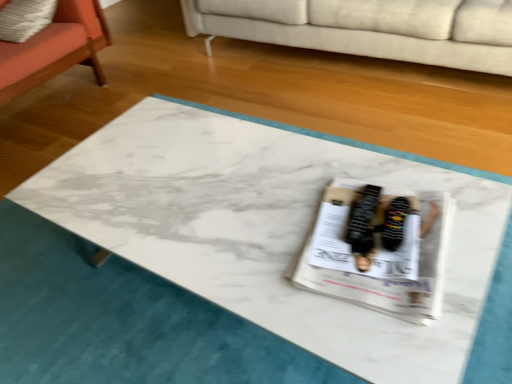
Question: From a real-world perspective, does black suede sneakers at center sit lower than white glossy magazine at center?

Choices:
 (A) no
 (B) yes

Answer: (A)

Question: Is black suede sneakers at center surrounding white glossy magazine at center?

Choices:
 (A) yes
 (B) no

Answer: (B)

Question: Is black suede sneakers at center located outside white glossy magazine at center?

Choices:
 (A) yes
 (B) no

Answer: (B)

Question: From a real-world perspective, is black suede sneakers at center on white glossy magazine at center?

Choices:
 (A) no
 (B) yes

Answer: (B)

Question: Is black suede sneakers at center wider than white glossy magazine at center?

Choices:
 (A) no
 (B) yes

Answer: (A)

Question: Does black suede sneakers at center lie behind white glossy magazine at center?

Choices:
 (A) yes
 (B) no

Answer: (A)

Question: Is orange fabric chair at left to the left of black suede sneakers at center from the viewer's perspective?

Choices:
 (A) yes
 (B) no

Answer: (A)

Question: Is orange fabric chair at left outside black suede sneakers at center?

Choices:
 (A) yes
 (B) no

Answer: (A)

Question: From a real-world perspective, is orange fabric chair at left physically above black suede sneakers at center?

Choices:
 (A) no
 (B) yes

Answer: (A)

Question: Is orange fabric chair at left oriented towards black suede sneakers at center?

Choices:
 (A) yes
 (B) no

Answer: (A)

Question: Does orange fabric chair at left have a larger size compared to black suede sneakers at center?

Choices:
 (A) no
 (B) yes

Answer: (B)

Question: Is orange fabric chair at left directly adjacent to black suede sneakers at center?

Choices:
 (A) no
 (B) yes

Answer: (A)

Question: Considering the relative positions of white glossy magazine at center and orange fabric chair at left in the image provided, is white glossy magazine at center to the left of orange fabric chair at left from the viewer's perspective?

Choices:
 (A) yes
 (B) no

Answer: (B)